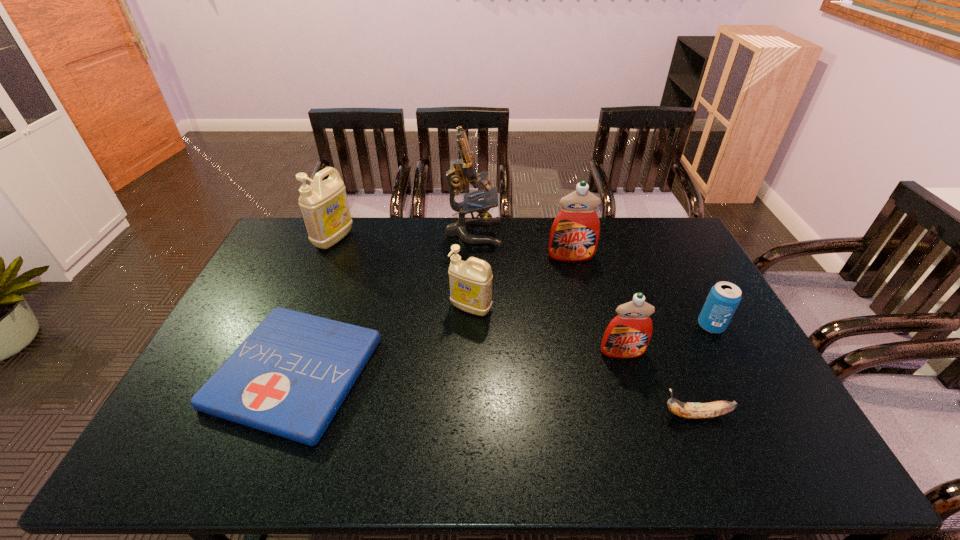
Locate an element on the screen. The image size is (960, 540). free spot between the rightmost object and the leftmost detergent is located at coordinates (522, 282).

This screenshot has height=540, width=960. Find the location of `empty space that is in between the tallest object and the leftmost detergent`. empty space that is in between the tallest object and the leftmost detergent is located at coordinates (403, 236).

At what (x,y) coordinates should I click in order to perform the action: click on vacant area that lies between the rightmost object and the banana. Please return your answer as a coordinate pair (x, y). Looking at the image, I should click on (704, 370).

Image resolution: width=960 pixels, height=540 pixels. Find the location of `unoccupied position between the banana and the shortest object`. unoccupied position between the banana and the shortest object is located at coordinates (495, 394).

Image resolution: width=960 pixels, height=540 pixels. What are the coordinates of `vacant point located between the leftmost detergent and the banana` in the screenshot? It's located at coord(515,327).

Identify which object is located as the fourth nearest to the first-aid kit. Please provide its 2D coordinates. Your answer should be formatted as a tuple, i.e. [(x, y)], where the tuple contains the x and y coordinates of a point satisfying the conditions above.

[(574, 235)]

The image size is (960, 540). What are the coordinates of `object that stands as the fourth closest to the farther beige detergent` in the screenshot? It's located at (574, 235).

The width and height of the screenshot is (960, 540). I want to click on detergent that stands as the third closest to the farther beige detergent, so click(x=628, y=334).

Identify which detergent is the second nearest to the second nearest detergent. Please provide its 2D coordinates. Your answer should be formatted as a tuple, i.e. [(x, y)], where the tuple contains the x and y coordinates of a point satisfying the conditions above.

[(628, 334)]

This screenshot has width=960, height=540. Identify the location of free space that satisfies the following two spatial constraints: 1. on the front surface of the sixth tallest object; 2. on the right side of the farther red detergent. pyautogui.click(x=588, y=326).